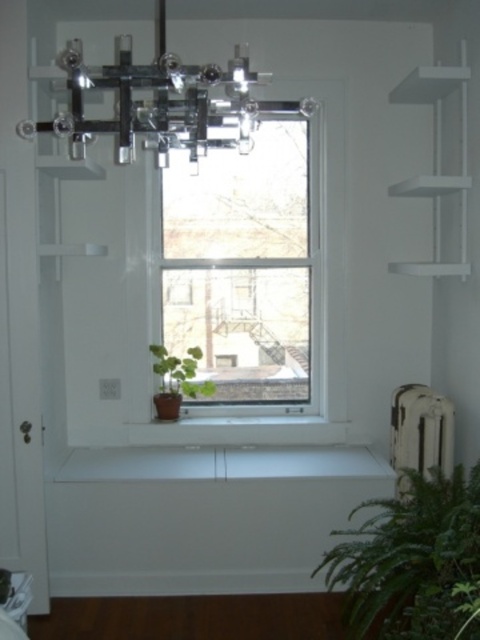
Question: Which object appears closest to the camera in this image?

Choices:
 (A) green leafy plant at lower right
 (B) white matte shelf at upper right
 (C) clear glass window at center
 (D) green matte plant at lower left

Answer: (A)

Question: Which point appears closest to the camera in this image?

Choices:
 (A) (415, 548)
 (B) (436, 84)
 (C) (160, 344)

Answer: (A)

Question: Considering the relative positions of clear glass window at center and white matte shelf at upper right in the image provided, where is clear glass window at center located with respect to white matte shelf at upper right?

Choices:
 (A) left
 (B) right

Answer: (A)

Question: In this image, where is white matte shelf at upper right located relative to green matte plant at lower left?

Choices:
 (A) above
 (B) below

Answer: (A)

Question: Is clear glass window at center bigger than white matte shelf at upper right?

Choices:
 (A) no
 (B) yes

Answer: (B)

Question: Considering the real-world distances, which object is closest to the green matte plant at lower left?

Choices:
 (A) clear glass window at center
 (B) green leafy plant at lower right
 (C) white matte shelf at upper right

Answer: (A)